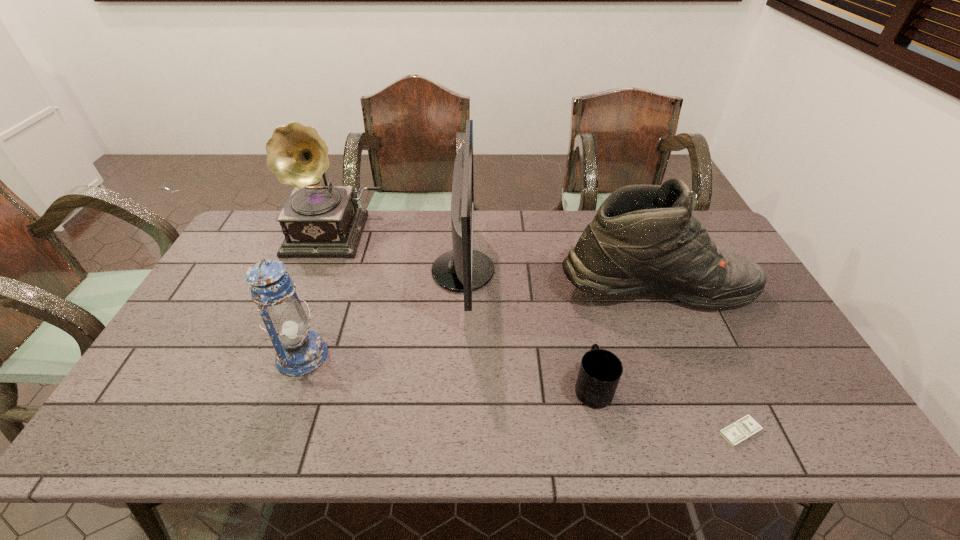
The height and width of the screenshot is (540, 960). What are the coordinates of `free location that satisfies the following two spatial constraints: 1. on the back side of the ski boot; 2. on the screen side of the monitor` in the screenshot? It's located at coord(648,271).

Image resolution: width=960 pixels, height=540 pixels. Identify the location of free region that satisfies the following two spatial constraints: 1. on the front side of the ski boot; 2. on the front-facing side of the lantern. (684, 355).

You are a GUI agent. You are given a task and a screenshot of the screen. Output one action in this format:
    pyautogui.click(x=<x>, y=<y>)
    Task: Click on the free space in the image that satisfies the following two spatial constraints: 1. on the back side of the nearest object; 2. on the screen side of the third object from left to right
    The width and height of the screenshot is (960, 540).
    Given the screenshot: What is the action you would take?
    [666, 271]